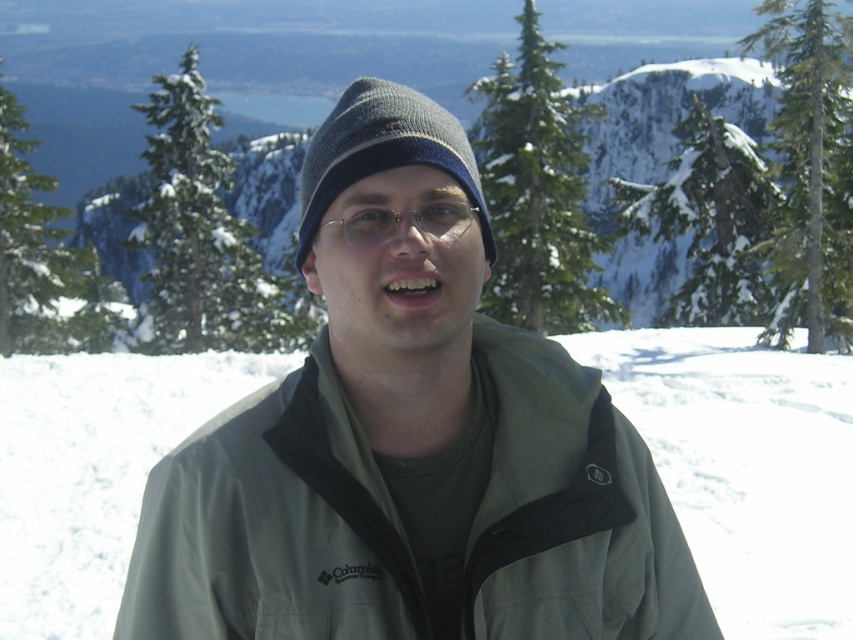
Between green fabric jacket at center and snowy mountain at center, which one has less height?

green fabric jacket at center is shorter.

Which of these two, green fabric jacket at center or snowy mountain at center, stands taller?

snowy mountain at center

Between point (343, 392) and point (277, 148), which one is positioned in front?

Point (343, 392) is in front.

Identify the location of green fabric jacket at center. (273, 528).

Is green textured pine at upper center bigger than knit woolen beanie at center?

Yes.

Is green textured pine at upper center shorter than knit woolen beanie at center?

Incorrect, green textured pine at upper center's height does not fall short of knit woolen beanie at center's.

Find the location of a particular element. Image resolution: width=853 pixels, height=640 pixels. green textured pine at upper center is located at coordinates (538, 192).

Which of these two, snowy mountain at center or knit woolen beanie at center, stands shorter?

knit woolen beanie at center

Is point (670, 273) positioned behind point (425, 163)?

Yes.

Locate an element on the screen. snowy mountain at center is located at coordinates (668, 115).